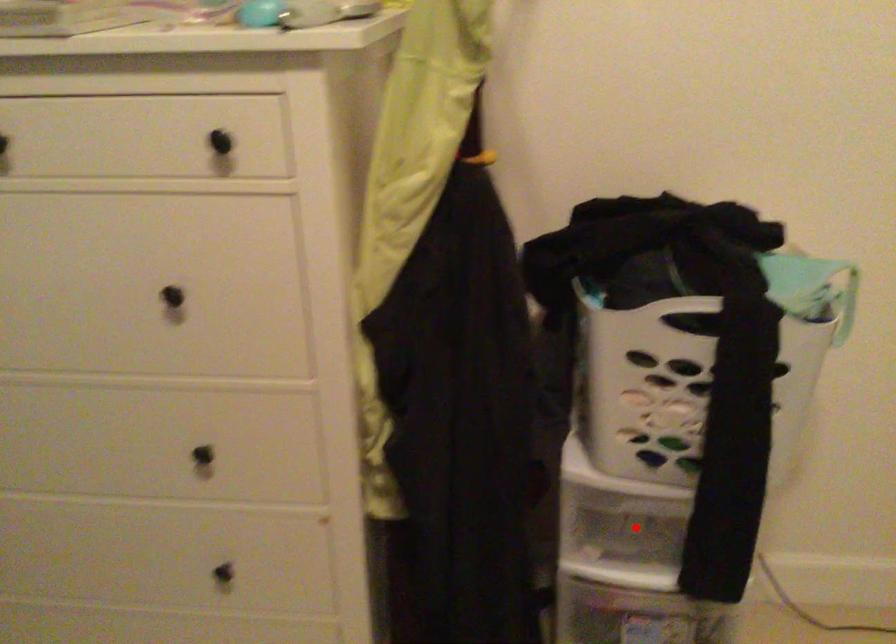
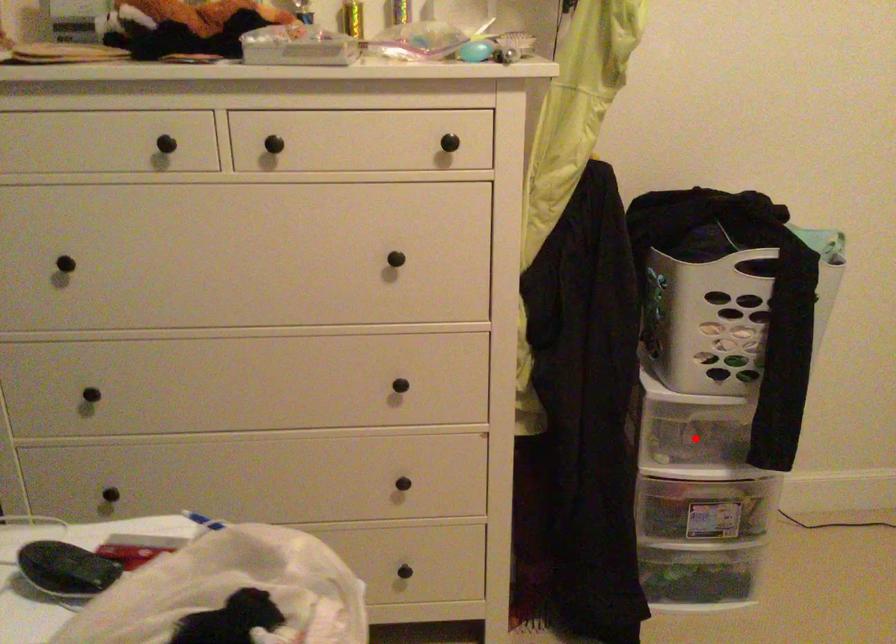
I am providing you with two images of the same scene from different viewpoints. A red point is marked on the first image and another point is marked on the second image. Are the points marked in image1 and image2 representing the same 3D position?

Yes